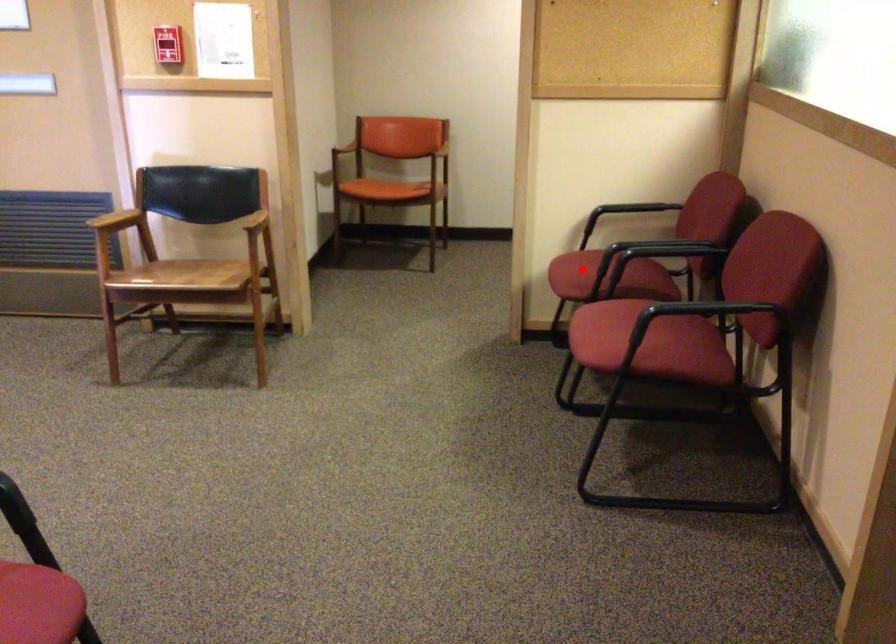
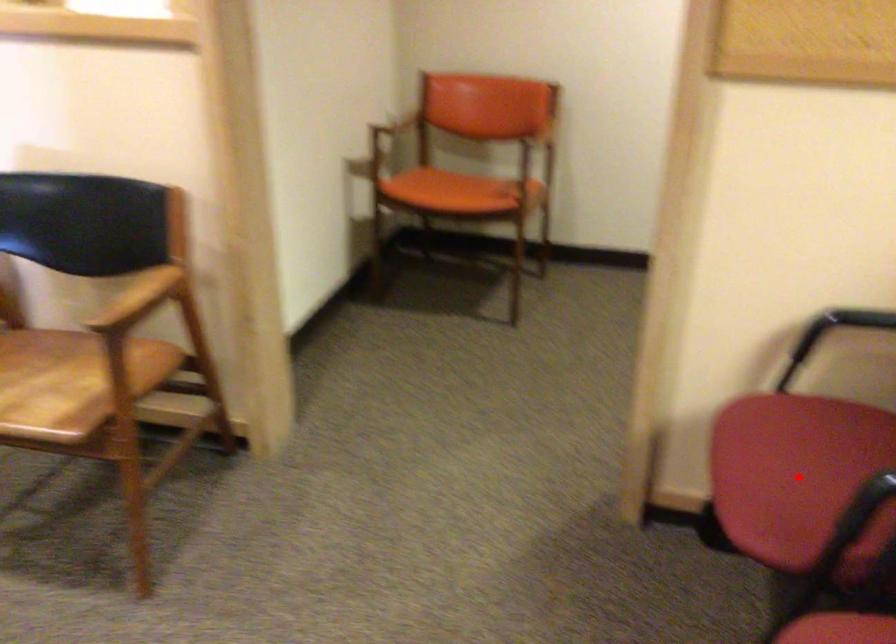
I am providing you with two images of the same scene from different viewpoints. A red point is marked on the first image and another point is marked on the second image. Are the points marked in image1 and image2 representing the same 3D position?

Yes